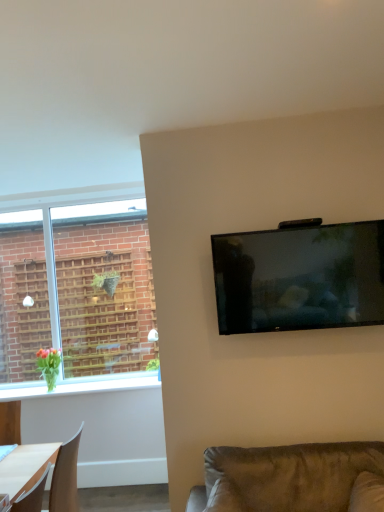
Identify the location of empty space that is ontop of white glossy window sill at lower left (from a real-world perspective). This screenshot has height=512, width=384. (77, 384).